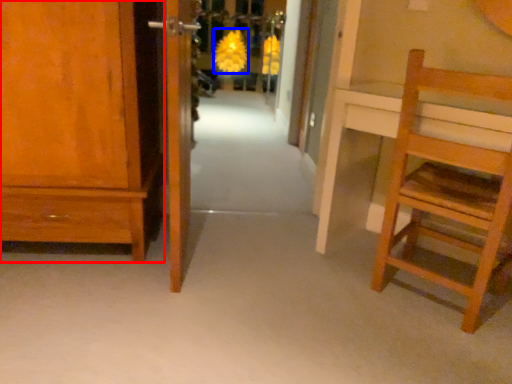
Question: Among these objects, which one is farthest to the camera, cabinetry (highlighted by a red box) or flower (highlighted by a blue box)?

Choices:
 (A) cabinetry
 (B) flower

Answer: (B)